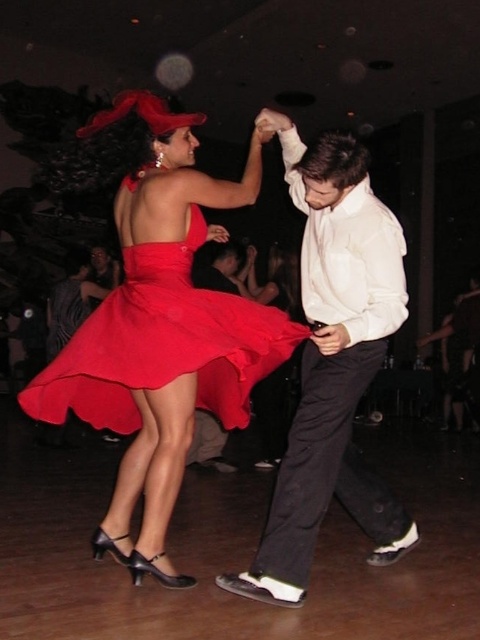
Question: Can you confirm if matte red dress at center is positioned below matte satin dress at center?

Choices:
 (A) yes
 (B) no

Answer: (B)

Question: Is matte red dress at center smaller than matte satin dress at center?

Choices:
 (A) yes
 (B) no

Answer: (B)

Question: Among these objects, which one is farthest from the camera?

Choices:
 (A) matte red dress at center
 (B) matte satin dress at center
 (C) white smooth shirt at center

Answer: (B)

Question: Which object appears farthest from the camera in this image?

Choices:
 (A) matte satin dress at center
 (B) matte red dress at center
 (C) white smooth shirt at center

Answer: (A)

Question: Which point is farther to the camera?

Choices:
 (A) (325, 212)
 (B) (253, 301)

Answer: (B)

Question: Can you confirm if white smooth shirt at center is wider than matte satin dress at center?

Choices:
 (A) no
 (B) yes

Answer: (A)